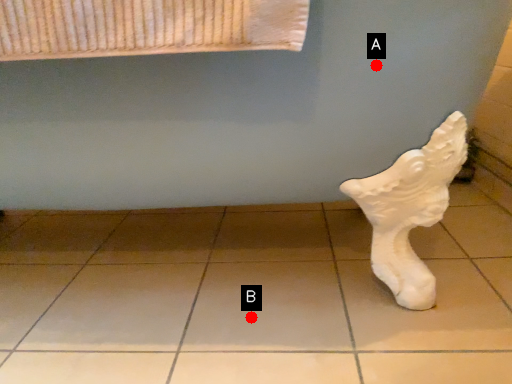
Question: Two points are circled on the image, labeled by A and B beside each circle. Which point is further to the camera?

Choices:
 (A) A is further
 (B) B is further

Answer: (B)